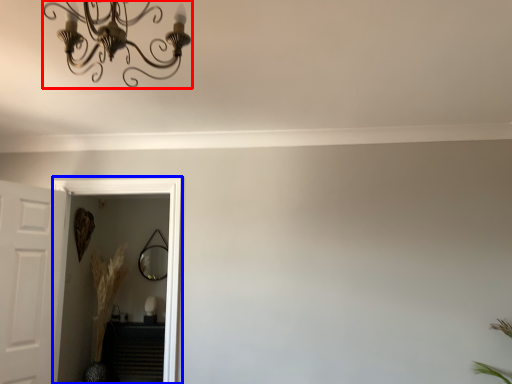
Question: Which object is further to the camera taking this photo, light fixture (highlighted by a red box) or glass door (highlighted by a blue box)?

Choices:
 (A) light fixture
 (B) glass door

Answer: (B)